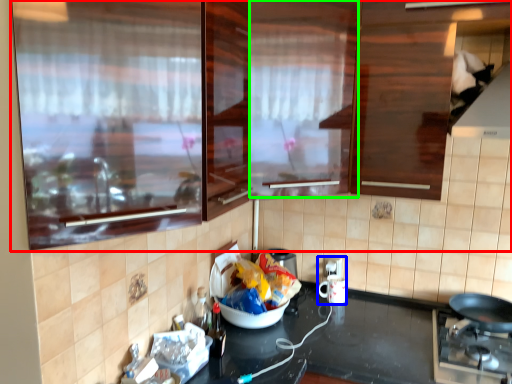
Question: Which is farther away from cabinetry (highlighted by a red box)? appliance (highlighted by a blue box) or glass door (highlighted by a green box)?

Choices:
 (A) appliance
 (B) glass door

Answer: (A)